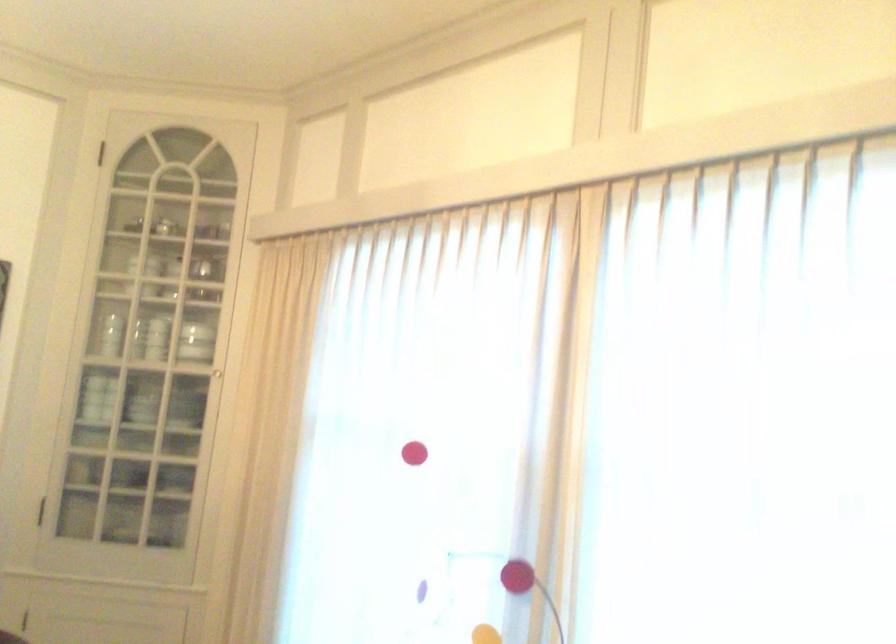
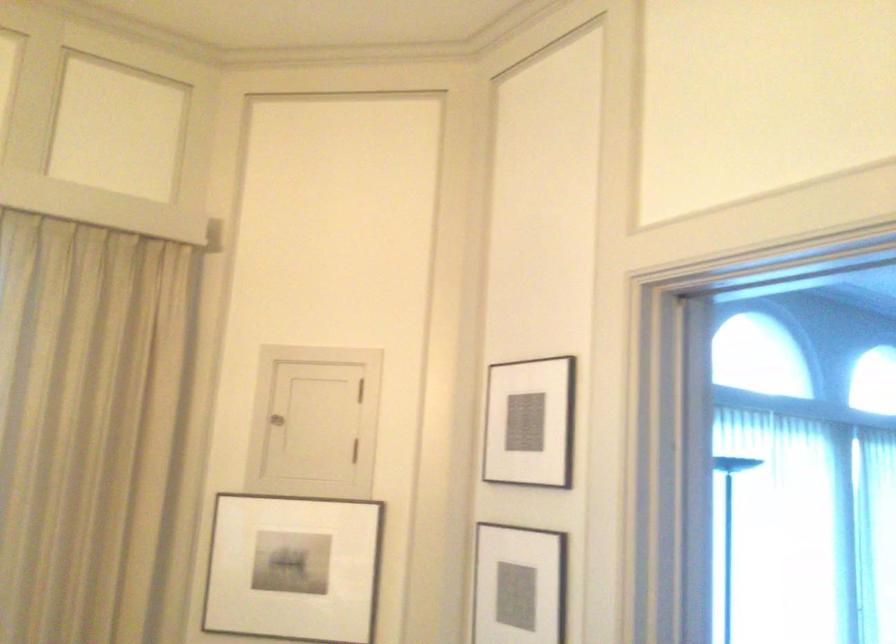
Question: The camera is either moving clockwise (left) or counter-clockwise (right) around the object. The first image is from the beginning of the video and the second image is from the end. Is the camera moving left or right when shooting the video?

Choices:
 (A) Left
 (B) Right

Answer: (A)